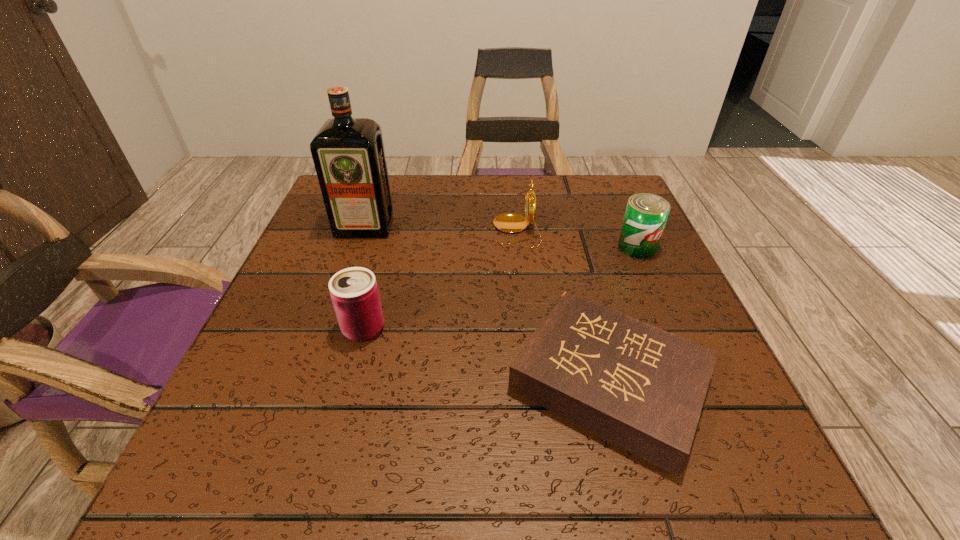
At what (x,y) coordinates should I click in order to perform the action: click on vacant position located on the back of the right can. Please return your answer as a coordinate pair (x, y). The image size is (960, 540). Looking at the image, I should click on (625, 218).

Where is `vacant space located 0.290m on the back of the shortest object`? vacant space located 0.290m on the back of the shortest object is located at coordinates coord(567,222).

Find the location of `liquor that is at the far edge`. liquor that is at the far edge is located at coordinates (348, 153).

Locate an element on the screen. The height and width of the screenshot is (540, 960). pocket watch positioned at the far edge is located at coordinates 510,223.

Where is `object that is positioned at the near edge`? This screenshot has width=960, height=540. object that is positioned at the near edge is located at coordinates (642, 388).

Locate an element on the screen. This screenshot has height=540, width=960. liquor located in the left edge section of the desktop is located at coordinates (348, 153).

Identify the location of can situated at the left edge. This screenshot has width=960, height=540. (354, 292).

Locate an element on the screen. The image size is (960, 540). can at the right edge is located at coordinates (646, 214).

The height and width of the screenshot is (540, 960). In order to click on hardback book at the right edge in this screenshot , I will do `click(642, 388)`.

The width and height of the screenshot is (960, 540). Identify the location of object that is at the far left corner. (348, 153).